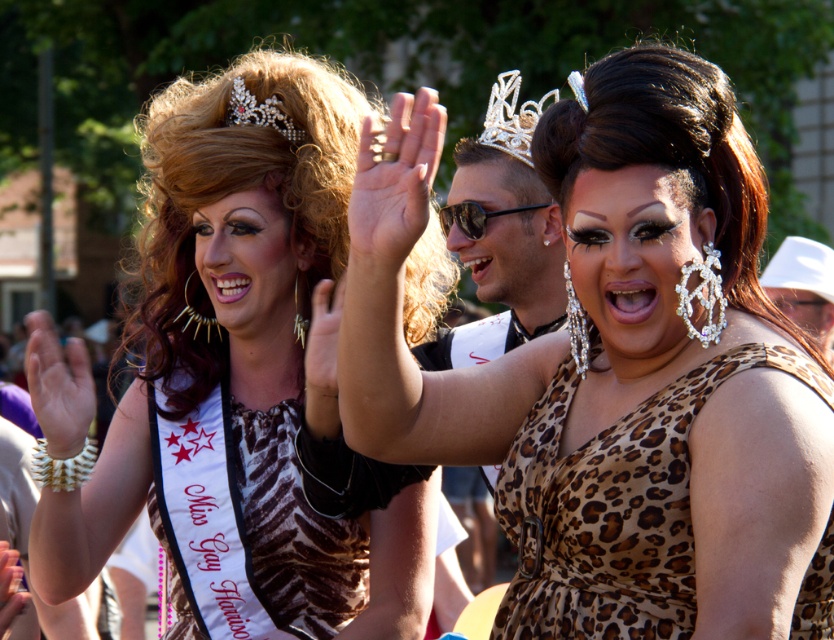
You are a photographer trying to capture the best shot of the parade. You notice two points marked in the image. The first point is at coordinate point (x=533, y=120) and the second is at point (x=254, y=99). Which point is positioned further away from the camera?

Point (x=533, y=120) is behind point (x=254, y=99), so it is further away from the camera.